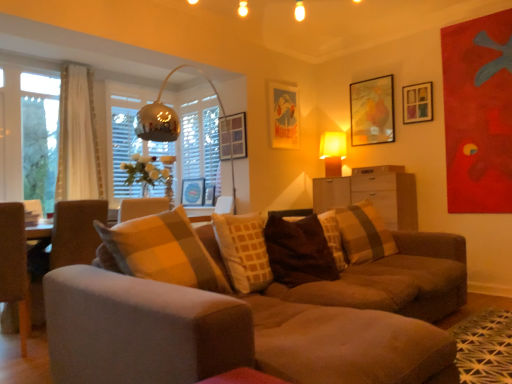
What do you see at coordinates (372, 111) in the screenshot? I see `matte wooden picture frame at upper right, which is counted as the fifth picture frame, starting from the left` at bounding box center [372, 111].

Describe the element at coordinates (364, 233) in the screenshot. The height and width of the screenshot is (384, 512). I see `plaid fabric pillow at center, marked as the first pillow in a back-to-front arrangement` at that location.

You are a GUI agent. You are given a task and a screenshot of the screen. Output one action in this format:
    pyautogui.click(x=<x>, y=<y>)
    Task: Click on the gray fabric swivel chair at left
    The height and width of the screenshot is (384, 512).
    Given the screenshot: What is the action you would take?
    pyautogui.click(x=75, y=232)

Measure the distance between metallic blue picture frame at center, which is the 6th picture frame in right-to-left order, and camera.

5.89 meters.

How much space does metallic blue picture frame at center, which is the first picture frame in left-to-right order, occupy horizontally?

It is 5.83 centimeters.

Locate an element on the screen. Image resolution: width=512 pixels, height=384 pixels. suede couch at center is located at coordinates (244, 314).

Can you confirm if matte brown dresser at center is positioned to the right of transparent glass door at left?

Yes, matte brown dresser at center is to the right of transparent glass door at left.

Is matte brown dresser at center inside or outside of transparent glass door at left?

matte brown dresser at center is spatially situated outside transparent glass door at left.

Are matte brown dresser at center and transparent glass door at left far apart?

Absolutely, matte brown dresser at center is distant from transparent glass door at left.

Who is taller, matte brown dresser at center or transparent glass door at left?

transparent glass door at left is taller.

From a real-world perspective, who is located higher, matte paper picture frame at upper center, which is the fourth picture frame in left-to-right order, or metallic blue picture frame at center, which is the 6th picture frame in right-to-left order?

From a 3D spatial view, matte paper picture frame at upper center, which is the fourth picture frame in left-to-right order, is above.

Where is `the 3rd picture frame to the right when counting from the metallic blue picture frame at center, which is the 6th picture frame in right-to-left order`? This screenshot has height=384, width=512. the 3rd picture frame to the right when counting from the metallic blue picture frame at center, which is the 6th picture frame in right-to-left order is located at coordinates (284, 115).

Measure the distance from matte paper picture frame at upper center, placed as the third picture frame when sorted from right to left, to metallic blue picture frame at center, which is the first picture frame in left-to-right order.

1.74 meters.

How many degrees apart are the facing directions of matte paper picture frame at upper center, placed as the third picture frame when sorted from right to left, and metallic blue picture frame at center, which is the 6th picture frame in right-to-left order?

They differ by 89.9 degrees in their facing directions.

The height and width of the screenshot is (384, 512). What are the coordinates of `glass door on the left of wooden chair at lower left` in the screenshot? It's located at (40, 137).

Is transparent glass door at left to the left or to the right of wooden chair at lower left in the image?

transparent glass door at left is positioned on wooden chair at lower left's left side.

Would you consider transparent glass door at left to be distant from wooden chair at lower left?

Indeed, transparent glass door at left is not near wooden chair at lower left.

Between plaid fabric pillow at center, the second pillow in the front-to-back sequence, and gray fabric swivel chair at left, which one has larger size?

Bigger between the two is gray fabric swivel chair at left.

Image resolution: width=512 pixels, height=384 pixels. In order to click on pillow that is the 2nd one above the gray fabric swivel chair at left (from a real-world perspective) in this screenshot , I will do coord(364,233).

Does plaid fabric pillow at center, the second pillow in the front-to-back sequence, have a greater height compared to gray fabric swivel chair at left?

Incorrect, the height of plaid fabric pillow at center, the second pillow in the front-to-back sequence, is not larger of that of gray fabric swivel chair at left.

Which is farther from the camera, (380, 218) or (69, 211)?

Positioned behind is point (380, 218).

From the image's perspective, between suede couch at center and plaid fabric pillow at center, marked as the first pillow in a back-to-front arrangement, who is located below?

From the image's view, suede couch at center is below.

Is suede couch at center taller than plaid fabric pillow at center, marked as the first pillow in a back-to-front arrangement?

Yes.

Based on their sizes in the image, would you say suede couch at center is bigger or smaller than plaid fabric pillow at center, the second pillow in the front-to-back sequence?

Considering their sizes, suede couch at center takes up more space than plaid fabric pillow at center, the second pillow in the front-to-back sequence.

Can you tell me how much suede couch at center and plaid fabric pillow at center, the second pillow in the front-to-back sequence, differ in facing direction?

The facing directions of suede couch at center and plaid fabric pillow at center, the second pillow in the front-to-back sequence, are 13.6 degrees apart.

Based on the photo, between metallic blue picture frame at center, which is the 6th picture frame in right-to-left order, and wooden chair at lower left, which one appears on the right side from the viewer's perspective?

Positioned to the right is metallic blue picture frame at center, which is the 6th picture frame in right-to-left order.

From the picture: From the image's perspective, is metallic blue picture frame at center, which is the 6th picture frame in right-to-left order, located beneath wooden chair at lower left?

No, from the image's perspective, metallic blue picture frame at center, which is the 6th picture frame in right-to-left order, is not below wooden chair at lower left.

This screenshot has width=512, height=384. Find the location of `the 6th picture frame behind when counting from the wooden chair at lower left`. the 6th picture frame behind when counting from the wooden chair at lower left is located at coordinates (193, 192).

Can you confirm if metallic blue picture frame at center, which is the first picture frame in left-to-right order, is shorter than wooden chair at lower left?

Correct, metallic blue picture frame at center, which is the first picture frame in left-to-right order, is not as tall as wooden chair at lower left.

Is matte wooden picture frame at center, the 5th picture frame when ordered from right to left, not near white sheer curtain at left?

matte wooden picture frame at center, the 5th picture frame when ordered from right to left, is far away from white sheer curtain at left.

Could you tell me if matte wooden picture frame at center, which is the 2th picture frame in left-to-right order, is turned towards white sheer curtain at left?

No, matte wooden picture frame at center, which is the 2th picture frame in left-to-right order, is not aimed at white sheer curtain at left.

Which of these two, matte wooden picture frame at center, the 5th picture frame when ordered from right to left, or white sheer curtain at left, is thinner?

Thinner between the two is matte wooden picture frame at center, the 5th picture frame when ordered from right to left.

Is matte wooden picture frame at center, the 5th picture frame when ordered from right to left, to the left of white sheer curtain at left from the viewer's perspective?

Incorrect, matte wooden picture frame at center, the 5th picture frame when ordered from right to left, is not on the left side of white sheer curtain at left.

The image size is (512, 384). Identify the location of dresser beneath the transparent glass door at left (from a real-world perspective). (372, 193).

From the image's perspective, count 2nd picture frames downward from the matte paper picture frame at upper center, placed as the third picture frame when sorted from right to left, and point to it. Please provide its 2D coordinates.

[(193, 192)]

From the image, which object appears to be farther from suede couch at center, matte glass picture frame at center, the 3th picture frame from the left, or transparent glass door at left?

transparent glass door at left.

Estimate the real-world distances between objects in this image. Which object is further from brown suede pillow at center, which is the 1th pillow in front-to-back order, matte wooden picture frame at center, which is the 2th picture frame in left-to-right order, or matte wooden picture frame at upper right, the 2th picture frame from the right?

matte wooden picture frame at center, which is the 2th picture frame in left-to-right order, is positioned further to the anchor brown suede pillow at center, which is the 1th pillow in front-to-back order.

Looking at the image, which one is located further to white sheer curtain at left, matte glass picture frame at center, the 3th picture frame from the left, or plaid fabric pillow at center, the second pillow in the front-to-back sequence?

plaid fabric pillow at center, the second pillow in the front-to-back sequence, is further to white sheer curtain at left.

Looking at the image, which one is located closer to yellow fabric lampshade at upper right, matte brown dresser at center or suede couch at center?

Among the two, matte brown dresser at center is located nearer to yellow fabric lampshade at upper right.

Looking at this image, looking at the image, which one is located further to matte wooden picture frame at center, the 5th picture frame when ordered from right to left, matte wooden picture frame at upper right, the 2th picture frame from the right, or wooden picture frame at upper right, which is the 6th picture frame from left to right?

wooden picture frame at upper right, which is the 6th picture frame from left to right.

Consider the image. Estimate the real-world distances between objects in this image. Which object is closer to white sheer curtain at left, plaid fabric pillow at center, marked as the first pillow in a back-to-front arrangement, or matte wooden picture frame at center, the 5th picture frame when ordered from right to left?

The object closer to white sheer curtain at left is matte wooden picture frame at center, the 5th picture frame when ordered from right to left.

Estimate the real-world distances between objects in this image. Which object is further from matte glass picture frame at center, the 3th picture frame from the left, suede couch at center or white sheer curtain at left?

suede couch at center.

When comparing their distances from wooden picture frame at upper right, which is the 6th picture frame from left to right, does wooden chair at lower left or matte wooden picture frame at center, which is the 2th picture frame in left-to-right order, seem further?

wooden chair at lower left lies further to wooden picture frame at upper right, which is the 6th picture frame from left to right, than the other object.

Identify the location of lighting between matte wooden picture frame at upper right, the 2th picture frame from the right, and matte brown dresser at center in the up-down direction. The height and width of the screenshot is (384, 512). (333, 152).

The image size is (512, 384). What are the coordinates of `lighting positioned between brown suede pillow at center, placed as the second pillow when sorted from back to front, and matte wooden picture frame at center, the 5th picture frame when ordered from right to left, from near to far` in the screenshot? It's located at (333, 152).

This screenshot has height=384, width=512. What are the coordinates of `lighting that lies between matte paper picture frame at upper center, which is the fourth picture frame in left-to-right order, and matte brown dresser at center from top to bottom` in the screenshot? It's located at (333, 152).

At what (x,y) coordinates should I click in order to perform the action: click on glass door positioned between wooden chair at lower left and matte wooden picture frame at center, the 5th picture frame when ordered from right to left, from near to far. Please return your answer as a coordinate pair (x, y). The height and width of the screenshot is (384, 512). Looking at the image, I should click on (40, 137).